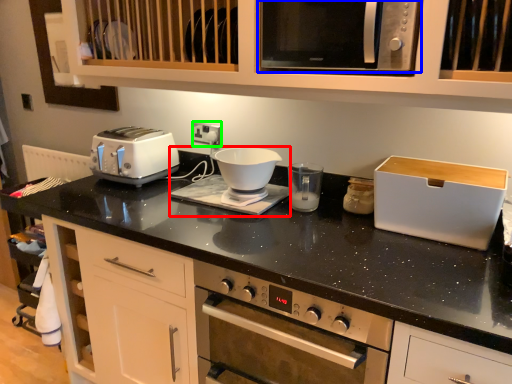
Question: Which is farther away from coffee machine (highlighted by a red box)? microwave oven (highlighted by a blue box) or electric outlet (highlighted by a green box)?

Choices:
 (A) microwave oven
 (B) electric outlet

Answer: (A)